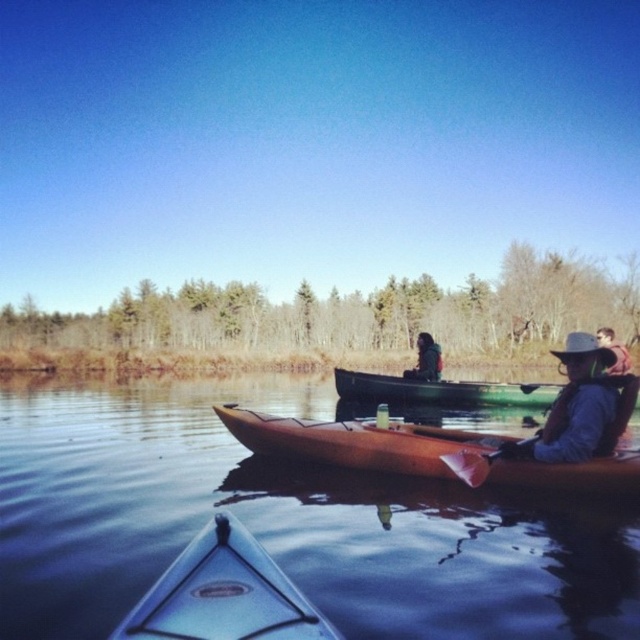
In the scene shown: Which of these two, brown matte kayak at center or green plastic canoe at center, stands shorter?

brown matte kayak at center is shorter.

Is point (294, 452) farther from viewer compared to point (637, 397)?

Yes, point (294, 452) is farther from viewer.

Who is more distant from viewer, (339, 428) or (433, 387)?

The point (433, 387) is behind.

Identify the location of brown matte kayak at center. Image resolution: width=640 pixels, height=640 pixels. (355, 442).

Does brown leather jacket at lower right have a larger size compared to smooth brown leather jacket at right?

Incorrect, brown leather jacket at lower right is not larger than smooth brown leather jacket at right.

Is point (579, 440) closer to viewer compared to point (611, 369)?

Yes, it is.

Does point (600, 371) come behind point (609, 344)?

No, (600, 371) is closer to viewer.

The height and width of the screenshot is (640, 640). I want to click on brown leather jacket at lower right, so click(584, 404).

Which is in front, point (508, 499) or point (611, 460)?

Point (611, 460)

Which is behind, point (577, 636) or point (588, 477)?

Point (588, 477)

In order to click on brown matte water at center in this screenshot , I will do `click(284, 522)`.